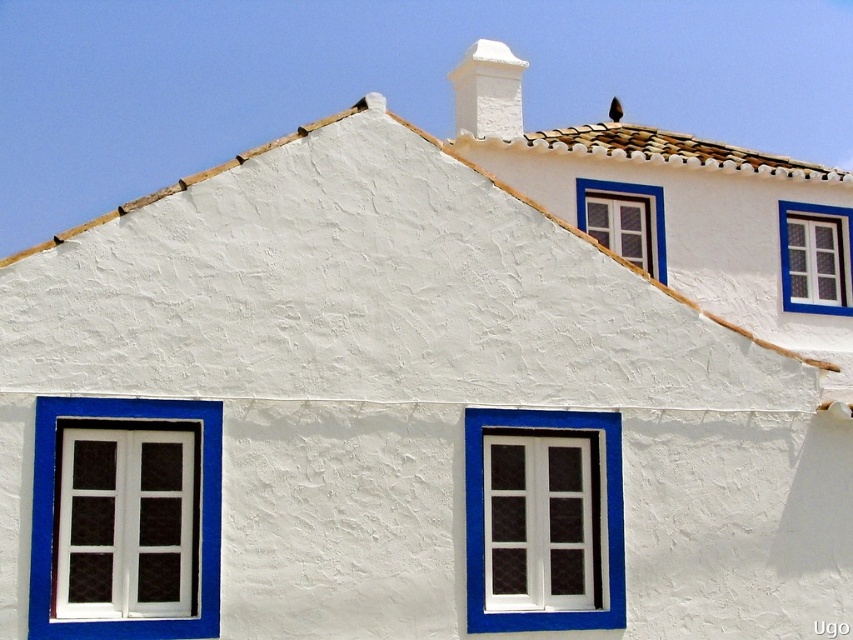
You are an architect planning to install a new window in the building. You have two options based on the existing windows shown. The first option is to use the dimensions of the white painted wood window at lower left, and the second is to use the dimensions of the white painted wood window at upper center. Which window option would allow for a larger window opening to let in more natural light?

The white painted wood window at lower left might be wider than the white painted wood window at upper center, so choosing the dimensions of the white painted wood window at lower left would allow for a larger window opening to let in more natural light.

You are an architect designing a new building inspired by Mediterranean architecture. You want to ensure that the brown clay tiles at upper center and the white painted wood window at upper center maintain the traditional aesthetic. Based on their sizes, which element should be placed higher on the structure to adhere to the style?

The brown clay tiles at upper center should be placed higher on the structure since they are much taller than the white painted wood window at upper center, aligning with the traditional Mediterranean roof design where tiles dominate the upper portions.